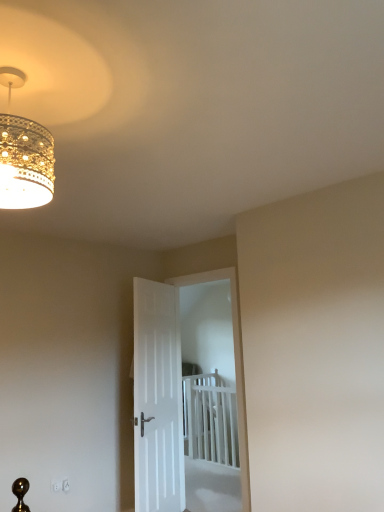
Where is `white plastic bed at center`? white plastic bed at center is located at coordinates (210, 419).

What is the approximate height of white plastic bed at center?

The height of white plastic bed at center is 39.14 inches.

Describe the element at coordinates (188, 395) in the screenshot. Image resolution: width=384 pixels, height=512 pixels. I see `white matte door at center, placed as the first door when sorted from right to left` at that location.

The width and height of the screenshot is (384, 512). What are the coordinates of `white plastic bed at center` in the screenshot? It's located at (210, 419).

How many degrees apart are the facing directions of white smooth door at center, marked as the 1th door in a left-to-right arrangement, and white matte door at center, which appears as the 2th door when viewed from the left?

The facing directions of white smooth door at center, marked as the 1th door in a left-to-right arrangement, and white matte door at center, which appears as the 2th door when viewed from the left, are 113 degrees apart.

Considering the relative sizes of white smooth door at center, marked as the 1th door in a left-to-right arrangement, and white matte door at center, which appears as the 2th door when viewed from the left, in the image provided, is white smooth door at center, marked as the 1th door in a left-to-right arrangement, shorter than white matte door at center, which appears as the 2th door when viewed from the left,?

Yes.

Can white matte door at center, which appears as the 2th door when viewed from the left, be found inside white smooth door at center, marked as the second door in a right-to-left arrangement?

No, white matte door at center, which appears as the 2th door when viewed from the left, is not inside white smooth door at center, marked as the second door in a right-to-left arrangement.

Can you confirm if gold textured chandelier at upper left is taller than white plastic bed at center?

In fact, gold textured chandelier at upper left may be shorter than white plastic bed at center.

How different are the orientations of gold textured chandelier at upper left and white plastic bed at center in degrees?

There is a 176-degree angle between the facing directions of gold textured chandelier at upper left and white plastic bed at center.

From a real-world perspective, is gold textured chandelier at upper left positioned under white plastic bed at center based on gravity?

No, from a real-world perspective, gold textured chandelier at upper left is not below white plastic bed at center.

Considering their positions, is gold textured chandelier at upper left located in front of or behind white plastic bed at center?

Clearly, gold textured chandelier at upper left is in front of white plastic bed at center.

From a real-world perspective, is white smooth door at center, marked as the second door in a right-to-left arrangement, physically above gold textured chandelier at upper left?

No.

How much distance is there between white smooth door at center, marked as the second door in a right-to-left arrangement, and gold textured chandelier at upper left?

white smooth door at center, marked as the second door in a right-to-left arrangement, and gold textured chandelier at upper left are 2.41 meters apart.

Considering their positions, is white smooth door at center, marked as the second door in a right-to-left arrangement, located in front of or behind gold textured chandelier at upper left?

white smooth door at center, marked as the second door in a right-to-left arrangement, is behind gold textured chandelier at upper left.

Consider the image. Could you tell me if white smooth door at center, marked as the 1th door in a left-to-right arrangement, is turned towards gold textured chandelier at upper left?

No, white smooth door at center, marked as the 1th door in a left-to-right arrangement, is not turned towards gold textured chandelier at upper left.

Between point (198, 390) and point (225, 323), which one is positioned behind?

The point (225, 323) is more distant.

Considering the relative positions of white plastic bed at center and white matte door at center, placed as the first door when sorted from right to left, in the image provided, is white plastic bed at center to the left or to the right of white matte door at center, placed as the first door when sorted from right to left,?

white plastic bed at center is to the right of white matte door at center, placed as the first door when sorted from right to left.

Between white plastic bed at center and white matte door at center, placed as the first door when sorted from right to left, which one is positioned behind?

white plastic bed at center is behind.

How distant is white plastic bed at center from white matte door at center, placed as the first door when sorted from right to left?

4.80 centimeters.

Considering the relative sizes of white smooth door at center, marked as the 1th door in a left-to-right arrangement, and white plastic bed at center in the image provided, is white smooth door at center, marked as the 1th door in a left-to-right arrangement, taller than white plastic bed at center?

Correct, white smooth door at center, marked as the 1th door in a left-to-right arrangement, is much taller as white plastic bed at center.

From the image's perspective, does white smooth door at center, marked as the 1th door in a left-to-right arrangement, appear lower than white plastic bed at center?

No, from the image's perspective, white smooth door at center, marked as the 1th door in a left-to-right arrangement, is not beneath white plastic bed at center.

What's the angular difference between white smooth door at center, marked as the second door in a right-to-left arrangement, and white plastic bed at center's facing directions?

white smooth door at center, marked as the second door in a right-to-left arrangement, and white plastic bed at center are facing 113 degrees away from each other.

Which is correct: white smooth door at center, marked as the 1th door in a left-to-right arrangement, is inside white plastic bed at center, or outside of it?

white smooth door at center, marked as the 1th door in a left-to-right arrangement, exists outside the volume of white plastic bed at center.

Is white matte door at center, which appears as the 2th door when viewed from the left, directly adjacent to white smooth door at center, marked as the second door in a right-to-left arrangement?

They are not placed beside each other.

From the picture: From the image's perspective, is white matte door at center, which appears as the 2th door when viewed from the left, over white smooth door at center, marked as the second door in a right-to-left arrangement?

Yes, from the image's perspective, white matte door at center, which appears as the 2th door when viewed from the left, is on top of white smooth door at center, marked as the second door in a right-to-left arrangement.

From a real-world perspective, is white matte door at center, which appears as the 2th door when viewed from the left, located beneath white smooth door at center, marked as the 1th door in a left-to-right arrangement?

No.

From the picture: Considering the sizes of objects white matte door at center, which appears as the 2th door when viewed from the left, and white smooth door at center, marked as the 1th door in a left-to-right arrangement, in the image provided, who is taller, white matte door at center, which appears as the 2th door when viewed from the left, or white smooth door at center, marked as the 1th door in a left-to-right arrangement,?

white matte door at center, which appears as the 2th door when viewed from the left, is taller.

Based on the photo, is gold textured chandelier at upper left positioned behind white matte door at center, which appears as the 2th door when viewed from the left?

No.

Would you say gold textured chandelier at upper left is outside white matte door at center, placed as the first door when sorted from right to left?

Indeed, gold textured chandelier at upper left is completely outside white matte door at center, placed as the first door when sorted from right to left.

Who is smaller, gold textured chandelier at upper left or white matte door at center, which appears as the 2th door when viewed from the left?

gold textured chandelier at upper left is smaller.

What are the coordinates of `door that is under the white matte door at center, which appears as the 2th door when viewed from the left (from a real-world perspective)` in the screenshot? It's located at (158, 398).

The image size is (384, 512). I want to click on lamp that appears above the white plastic bed at center (from the image's perspective), so click(x=24, y=155).

When comparing their distances from white plastic bed at center, does gold textured chandelier at upper left or white matte door at center, which appears as the 2th door when viewed from the left, seem further?

Among the two, gold textured chandelier at upper left is located further to white plastic bed at center.

From the image, which object appears to be nearer to white matte door at center, placed as the first door when sorted from right to left, gold textured chandelier at upper left or white plastic bed at center?

white plastic bed at center is positioned closer to the anchor white matte door at center, placed as the first door when sorted from right to left.

Considering their positions, is white smooth door at center, marked as the 1th door in a left-to-right arrangement, positioned further to gold textured chandelier at upper left than white plastic bed at center?

white plastic bed at center is further to gold textured chandelier at upper left.

Looking at the image, which one is located closer to white plastic bed at center, white smooth door at center, marked as the second door in a right-to-left arrangement, or gold textured chandelier at upper left?

white smooth door at center, marked as the second door in a right-to-left arrangement, is positioned closer to the anchor white plastic bed at center.

Looking at the image, which one is located further to white plastic bed at center, white smooth door at center, marked as the second door in a right-to-left arrangement, or white matte door at center, which appears as the 2th door when viewed from the left?

white smooth door at center, marked as the second door in a right-to-left arrangement, is further to white plastic bed at center.

Estimate the real-world distances between objects in this image. Which object is closer to gold textured chandelier at upper left, white matte door at center, which appears as the 2th door when viewed from the left, or white smooth door at center, marked as the second door in a right-to-left arrangement?

white smooth door at center, marked as the second door in a right-to-left arrangement, is positioned closer to the anchor gold textured chandelier at upper left.

When comparing their distances from white smooth door at center, marked as the 1th door in a left-to-right arrangement, does white plastic bed at center or gold textured chandelier at upper left seem closer?

The object closer to white smooth door at center, marked as the 1th door in a left-to-right arrangement, is gold textured chandelier at upper left.

Which object lies nearer to the anchor point white plastic bed at center, white matte door at center, placed as the first door when sorted from right to left, or white smooth door at center, marked as the 1th door in a left-to-right arrangement?

The object closer to white plastic bed at center is white matte door at center, placed as the first door when sorted from right to left.

The width and height of the screenshot is (384, 512). Identify the location of door between gold textured chandelier at upper left and white matte door at center, placed as the first door when sorted from right to left, along the z-axis. (158, 398).

This screenshot has height=512, width=384. I want to click on door located between white smooth door at center, marked as the 1th door in a left-to-right arrangement, and white plastic bed at center in the depth direction, so click(x=188, y=395).